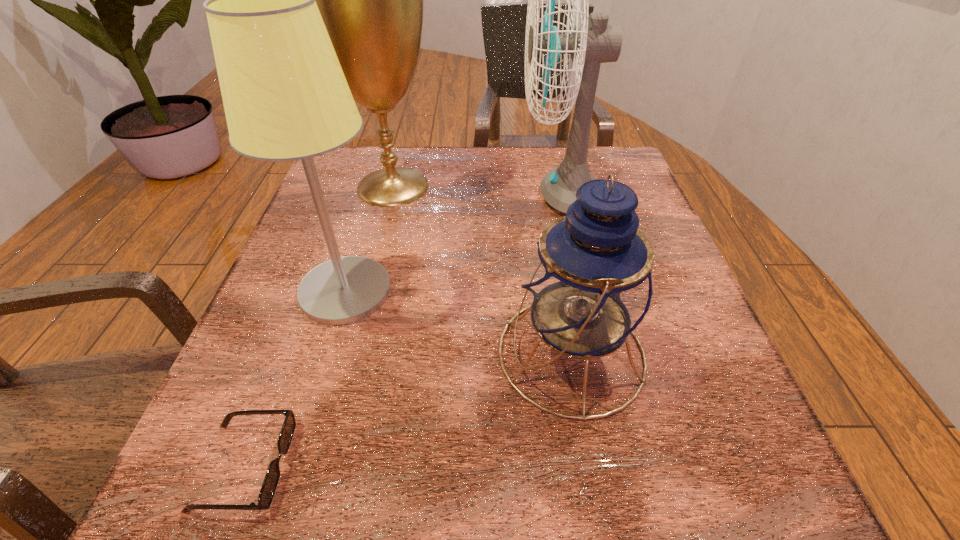
Locate an element on the screen. The height and width of the screenshot is (540, 960). vacant region between the trophy cup and the table lamp is located at coordinates (370, 239).

Select which object appears as the closest to the table lamp. Please provide its 2D coordinates. Your answer should be formatted as a tuple, i.e. [(x, y)], where the tuple contains the x and y coordinates of a point satisfying the conditions above.

[(371, 0)]

Locate an element on the screen. object that ranks as the third closest to the fan is located at coordinates (285, 96).

Locate an element on the screen. Image resolution: width=960 pixels, height=540 pixels. free point that satisfies the following two spatial constraints: 1. on the front-facing side of the fan; 2. on the front side of the table lamp is located at coordinates (581, 291).

Identify the location of vacant position in the image that satisfies the following two spatial constraints: 1. on the front side of the trophy cup; 2. on the front-facing side of the shortest object. (321, 465).

Locate an element on the screen. free space that satisfies the following two spatial constraints: 1. on the front side of the table lamp; 2. on the front-facing side of the shortest object is located at coordinates (293, 465).

Image resolution: width=960 pixels, height=540 pixels. I want to click on vacant area in the image that satisfies the following two spatial constraints: 1. on the front side of the trophy cup; 2. on the front-facing side of the shortest object, so click(x=321, y=465).